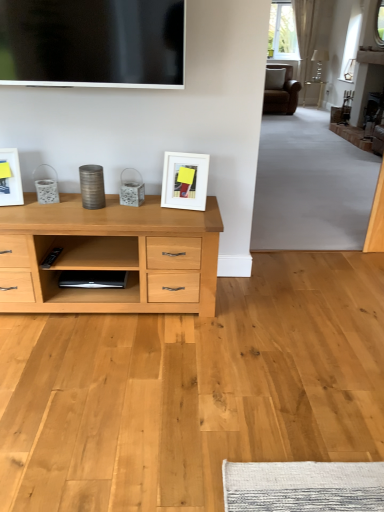
Question: Does flat screen tv at upper center come in front of white matte picture frame at center, the first picture frame in the right-to-left sequence?

Choices:
 (A) yes
 (B) no

Answer: (A)

Question: Would you say flat screen tv at upper center is outside white matte picture frame at center, the first picture frame in the right-to-left sequence?

Choices:
 (A) yes
 (B) no

Answer: (A)

Question: Does flat screen tv at upper center have a smaller size compared to white matte picture frame at center, acting as the 2th picture frame starting from the left?

Choices:
 (A) no
 (B) yes

Answer: (A)

Question: From a real-world perspective, is flat screen tv at upper center physically below white matte picture frame at center, the first picture frame in the right-to-left sequence?

Choices:
 (A) yes
 (B) no

Answer: (B)

Question: Is white matte picture frame at center, acting as the 2th picture frame starting from the left, completely or partially inside flat screen tv at upper center?

Choices:
 (A) yes
 (B) no

Answer: (B)

Question: Is white matte picture frame at center, acting as the 2th picture frame starting from the left, to the left or to the right of flat screen tv at upper center in the image?

Choices:
 (A) left
 (B) right

Answer: (B)

Question: From their relative heights in the image, would you say white matte picture frame at center, acting as the 2th picture frame starting from the left, is taller or shorter than flat screen tv at upper center?

Choices:
 (A) short
 (B) tall

Answer: (A)

Question: From the image's perspective, is white matte picture frame at center, acting as the 2th picture frame starting from the left, above or below flat screen tv at upper center?

Choices:
 (A) above
 (B) below

Answer: (B)

Question: Considering their positions, is white matte picture frame at center, the first picture frame in the right-to-left sequence, located in front of or behind flat screen tv at upper center?

Choices:
 (A) front
 (B) behind

Answer: (B)

Question: From a real-world perspective, relative to white matte picture frame at center, the first picture frame in the right-to-left sequence, is white glossy picture frame at left, positioned as the second picture frame in right-to-left order, vertically above or below?

Choices:
 (A) below
 (B) above

Answer: (B)

Question: Is white glossy picture frame at left, positioned as the second picture frame in right-to-left order, taller or shorter than white matte picture frame at center, the first picture frame in the right-to-left sequence?

Choices:
 (A) tall
 (B) short

Answer: (B)

Question: Which is correct: white glossy picture frame at left, placed as the first picture frame when sorted from left to right, is inside white matte picture frame at center, acting as the 2th picture frame starting from the left, or outside of it?

Choices:
 (A) outside
 (B) inside

Answer: (A)

Question: Is white glossy picture frame at left, placed as the first picture frame when sorted from left to right, wider or thinner than white matte picture frame at center, the first picture frame in the right-to-left sequence?

Choices:
 (A) wide
 (B) thin

Answer: (B)

Question: Is point (104, 31) closer or farther from the camera than point (4, 181)?

Choices:
 (A) farther
 (B) closer

Answer: (B)

Question: Considering the relative positions of flat screen tv at upper center and white glossy picture frame at left, positioned as the second picture frame in right-to-left order, in the image provided, is flat screen tv at upper center to the left or to the right of white glossy picture frame at left, positioned as the second picture frame in right-to-left order,?

Choices:
 (A) right
 (B) left

Answer: (A)